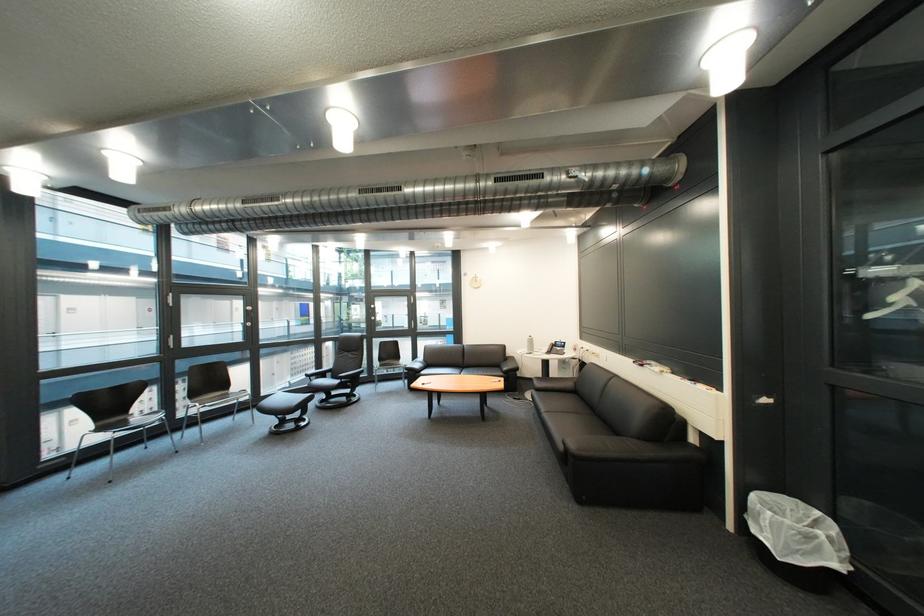
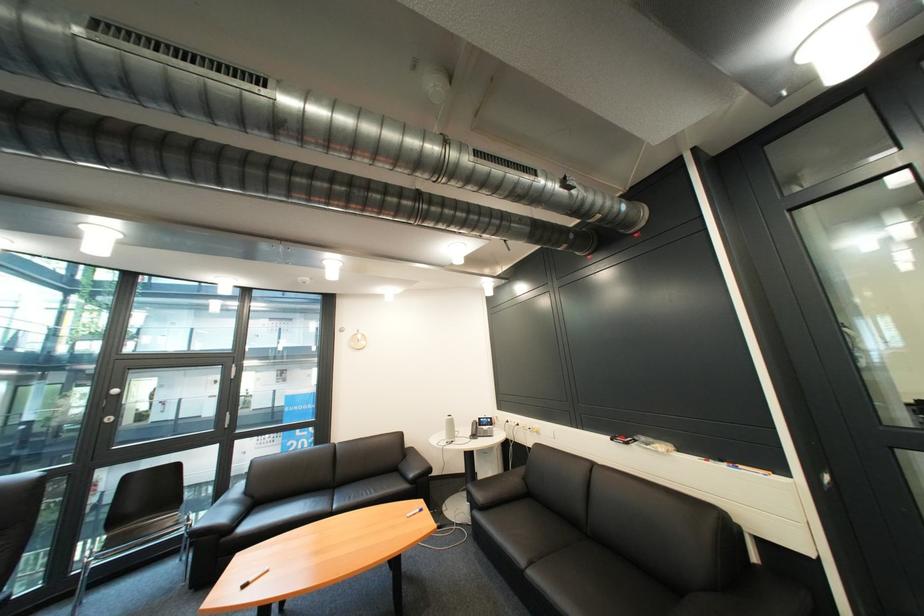
Find the pixel in the second image that matches point (383, 314) in the first image.

(118, 408)